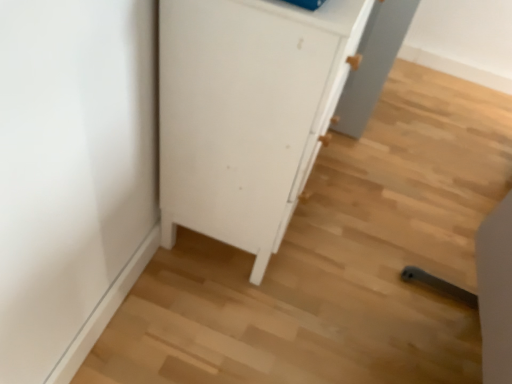
What do you see at coordinates (246, 112) in the screenshot?
I see `white matte cabinet at center` at bounding box center [246, 112].

Identify the location of white matte cabinet at center. (246, 112).

This screenshot has width=512, height=384. Describe the element at coordinates (487, 291) in the screenshot. I see `light wood chair at lower right` at that location.

Identify the location of light wood chair at lower right. The image size is (512, 384). (487, 291).

Find the location of a particular element. Image resolution: width=512 pixels, height=384 pixels. white matte cabinet at center is located at coordinates (246, 112).

Visually, is white matte cabinet at center positioned to the left or to the right of light wood chair at lower right?

Based on their positions, white matte cabinet at center is located to the left of light wood chair at lower right.

Who is more distant, white matte cabinet at center or light wood chair at lower right?

white matte cabinet at center.

Is point (266, 49) positioned before point (495, 358)?

No.

From the image's perspective, is white matte cabinet at center on top of light wood chair at lower right?

Indeed, from the image's perspective, white matte cabinet at center is shown above light wood chair at lower right.

From a real-world perspective, which object rests below the other?

light wood chair at lower right.

Is white matte cabinet at center wider than light wood chair at lower right?

Incorrect, the width of white matte cabinet at center does not surpass that of light wood chair at lower right.

Based on the photo, does white matte cabinet at center have a lesser height compared to light wood chair at lower right?

No, white matte cabinet at center is not shorter than light wood chair at lower right.

Who is smaller, white matte cabinet at center or light wood chair at lower right?

light wood chair at lower right.

Do you think white matte cabinet at center is within light wood chair at lower right, or outside of it?

white matte cabinet at center is outside light wood chair at lower right.

Is white matte cabinet at center not close to light wood chair at lower right?

No, there isn't a large distance between white matte cabinet at center and light wood chair at lower right.

Is white matte cabinet at center looking in the opposite direction of light wood chair at lower right?

No.

From the picture: How different are the orientations of white matte cabinet at center and light wood chair at lower right in degrees?

white matte cabinet at center and light wood chair at lower right are facing 89.1 degrees away from each other.

Measure the distance between white matte cabinet at center and light wood chair at lower right.

white matte cabinet at center is 26.92 inches away from light wood chair at lower right.

I want to click on chair on the right of the white matte cabinet at center, so (x=487, y=291).

Visually, is light wood chair at lower right positioned to the left or to the right of white matte cabinet at center?

light wood chair at lower right is to the right of white matte cabinet at center.

Is the depth of light wood chair at lower right greater than that of white matte cabinet at center?

No, light wood chair at lower right is in front of white matte cabinet at center.

Considering the points (506, 248) and (335, 59), which point is behind, point (506, 248) or point (335, 59)?

The point (506, 248) is behind.

From the image's perspective, is light wood chair at lower right above or below white matte cabinet at center?

Clearly, from the image's perspective, light wood chair at lower right is below white matte cabinet at center.

From a real-world perspective, is light wood chair at lower right physically above white matte cabinet at center?

Incorrect, from a real-world perspective, light wood chair at lower right is lower than white matte cabinet at center.

Is light wood chair at lower right thinner than white matte cabinet at center?

No, light wood chair at lower right is not thinner than white matte cabinet at center.

Consider the image. Can you confirm if light wood chair at lower right is taller than white matte cabinet at center?

In fact, light wood chair at lower right may be shorter than white matte cabinet at center.

Considering the relative sizes of light wood chair at lower right and white matte cabinet at center in the image provided, is light wood chair at lower right smaller than white matte cabinet at center?

Indeed, light wood chair at lower right has a smaller size compared to white matte cabinet at center.

Is light wood chair at lower right situated inside white matte cabinet at center or outside?

light wood chair at lower right cannot be found inside white matte cabinet at center.

Is the surface of light wood chair at lower right in direct contact with white matte cabinet at center?

No, light wood chair at lower right is not next to white matte cabinet at center.

Is light wood chair at lower right positioned with its back to white matte cabinet at center?

light wood chair at lower right does not have its back to white matte cabinet at center.

How distant is light wood chair at lower right from white matte cabinet at center?

A distance of 26.92 inches exists between light wood chair at lower right and white matte cabinet at center.

What are the coordinates of `cupboard behind the light wood chair at lower right` in the screenshot? It's located at (246, 112).

Locate an element on the screen. chair below the white matte cabinet at center (from a real-world perspective) is located at coordinates (487, 291).

This screenshot has width=512, height=384. In order to click on chair that is in front of the white matte cabinet at center in this screenshot , I will do `click(487, 291)`.